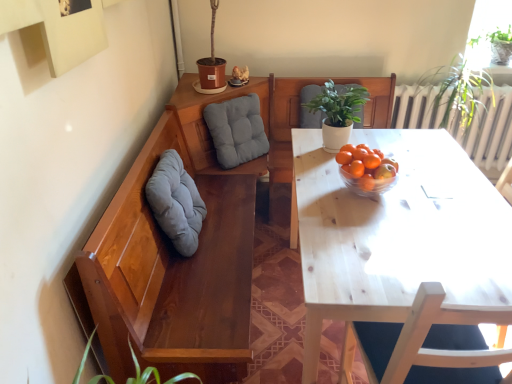
Question: Is matte gray cushion at center, which is counted as the 1th gray, starting from the back, wider or thinner than light wood table at center?

Choices:
 (A) thin
 (B) wide

Answer: (A)

Question: From the image's perspective, is matte gray cushion at center, which is counted as the 1th gray, starting from the back, located above or below light wood table at center?

Choices:
 (A) above
 (B) below

Answer: (A)

Question: Estimate the real-world distances between objects in this image. Which object is farther from the soft gray cushion at left, the second gray when ordered from back to front?

Choices:
 (A) matte gray cushion at center, the 2th gray positioned from the front
 (B) light wood table at center
 (C) transparent glass window at upper right
 (D) green matte plant at upper center

Answer: (C)

Question: Which of these objects is positioned farthest from the green matte plant at upper center?

Choices:
 (A) transparent glass window at upper right
 (B) soft gray cushion at left, the first gray from the front
 (C) light wood table at center
 (D) matte gray cushion at center, which is counted as the 1th gray, starting from the back

Answer: (A)